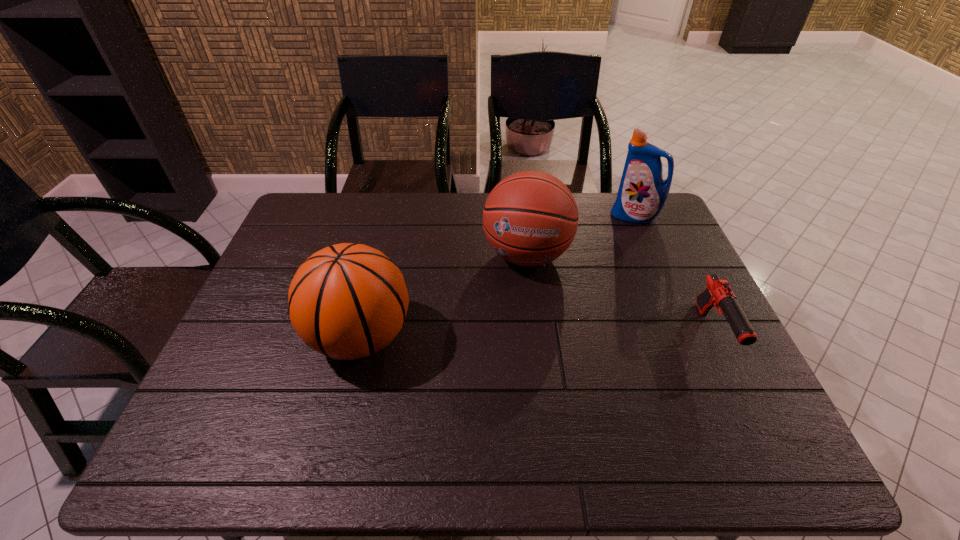
Identify the location of the left basketball. The height and width of the screenshot is (540, 960). (348, 301).

Where is `the nearer basketball`? the nearer basketball is located at coordinates (348, 301).

At what (x,y) coordinates should I click in order to perform the action: click on gun. Please return your answer as a coordinate pair (x, y). Looking at the image, I should click on (718, 293).

What are the coordinates of `the farthest object` in the screenshot? It's located at (642, 194).

The width and height of the screenshot is (960, 540). Identify the location of the farther basketball. (530, 218).

This screenshot has width=960, height=540. What are the coordinates of `the second object from left to right` in the screenshot? It's located at (530, 218).

Find the location of a particular element. The image size is (960, 540). vacant space located on the right of the left basketball is located at coordinates (508, 337).

Identify the location of vacant space positioned at the aiming end of the gun. The width and height of the screenshot is (960, 540). (751, 411).

Identify the location of vacant point located 0.080m on the label of the detergent. (617, 237).

Locate an element on the screen. blank area located 0.100m on the label of the detergent is located at coordinates (614, 240).